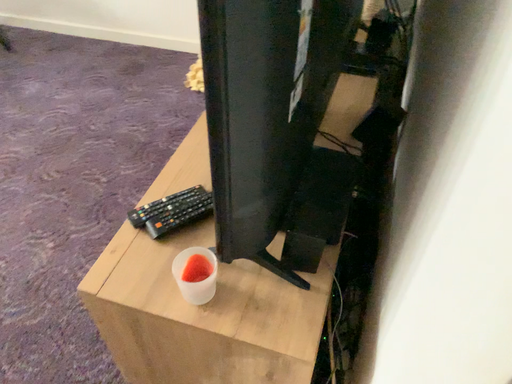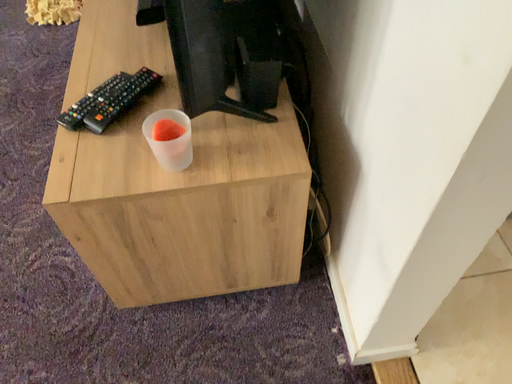
Question: How did the camera likely rotate when shooting the video?

Choices:
 (A) rotated right
 (B) rotated left

Answer: (A)